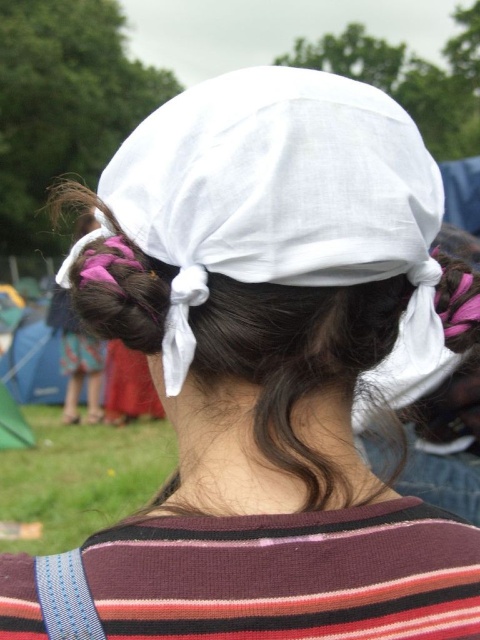
Is point (303, 113) positioned before point (468, 396)?

Yes, it is.

Is point (336, 150) positioned after point (444, 440)?

No, it is in front of (444, 440).

This screenshot has height=640, width=480. Describe the element at coordinates (287, 205) in the screenshot. I see `white cotton headscarf at center` at that location.

The height and width of the screenshot is (640, 480). What are the coordinates of `white cotton headscarf at center` in the screenshot? It's located at (287, 205).